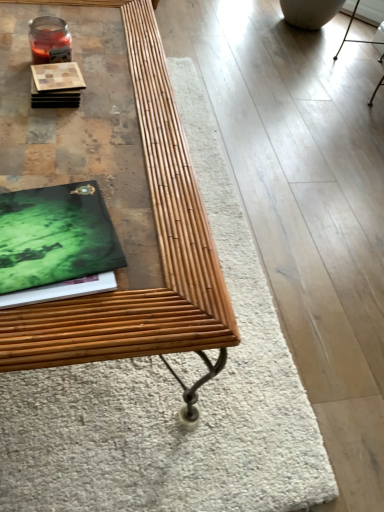
This screenshot has height=512, width=384. I want to click on free point behind wooden coaster at upper left, so click(109, 57).